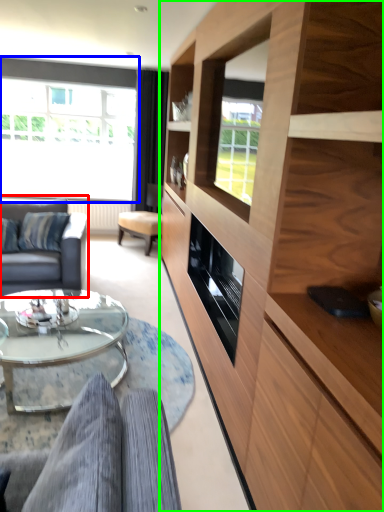
Question: Which object is the farthest from studio couch (highlighted by a red box)? Choose among these: window (highlighted by a blue box) or cabinetry (highlighted by a green box).

Choices:
 (A) window
 (B) cabinetry

Answer: (A)